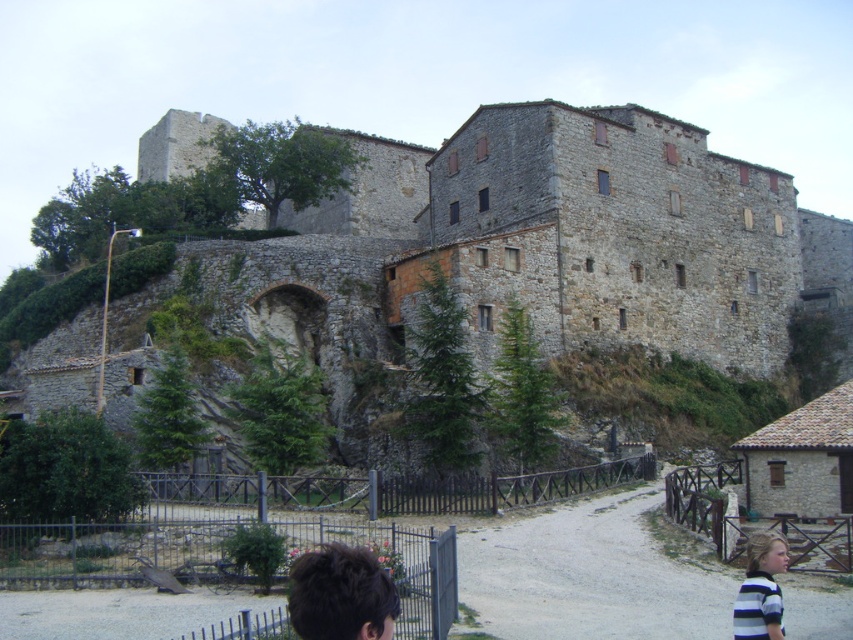
Question: Is dark brown hair at lower center thinner than striped fabric shirt at lower right?

Choices:
 (A) yes
 (B) no

Answer: (A)

Question: Is stone castle at upper center positioned at the back of dark brown hair at lower center?

Choices:
 (A) no
 (B) yes

Answer: (B)

Question: Which object is positioned closest to the stone castle at upper center?

Choices:
 (A) dark brown hair at lower center
 (B) striped fabric shirt at lower right

Answer: (B)

Question: Among these objects, which one is nearest to the camera?

Choices:
 (A) stone castle at upper center
 (B) dark brown hair at lower center

Answer: (B)

Question: Where is stone castle at upper center located in relation to dark brown hair at lower center in the image?

Choices:
 (A) right
 (B) left

Answer: (A)

Question: Which object appears farthest from the camera in this image?

Choices:
 (A) dark brown hair at lower center
 (B) striped fabric shirt at lower right

Answer: (B)